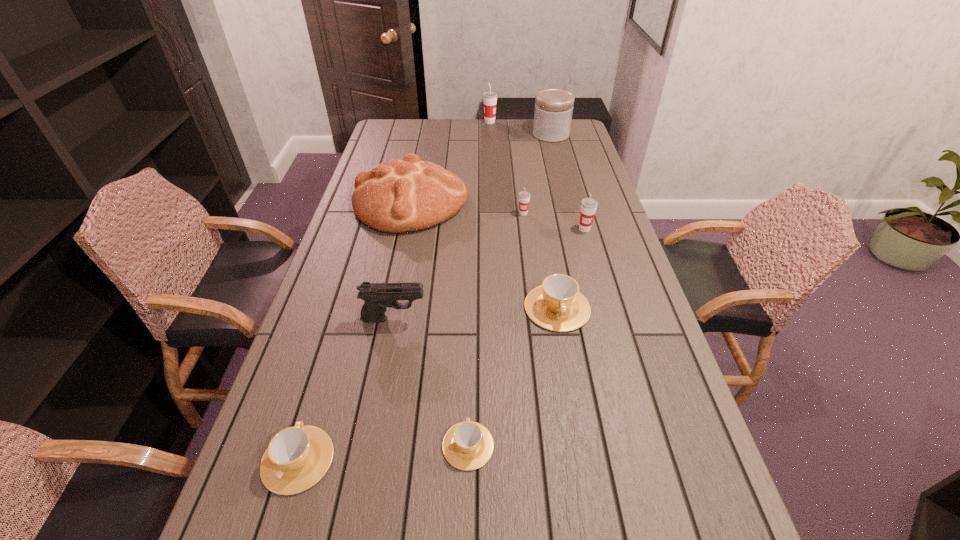
The image size is (960, 540). What are the coordinates of `cup that is at the far edge` in the screenshot? It's located at (490, 97).

You are a GUI agent. You are given a task and a screenshot of the screen. Output one action in this format:
    pyautogui.click(x=<x>, y=<y>)
    Task: Click on the jar situated at the far edge
    The height and width of the screenshot is (540, 960).
    Given the screenshot: What is the action you would take?
    pyautogui.click(x=553, y=111)

In order to click on bread at the left edge in this screenshot , I will do point(397,196).

The width and height of the screenshot is (960, 540). I want to click on pistol that is at the left edge, so click(x=377, y=296).

Where is `cup that is at the left edge`? The width and height of the screenshot is (960, 540). cup that is at the left edge is located at coordinates (297, 457).

Find the location of a particular element. The height and width of the screenshot is (540, 960). jar situated at the right edge is located at coordinates (553, 111).

I want to click on object that is at the far right corner, so click(553, 111).

Find the location of a particular element. Image resolution: width=960 pixels, height=540 pixels. vacant space at the left edge of the desktop is located at coordinates (327, 354).

In the image, there is a desktop. Find the location of `free space at the right edge`. free space at the right edge is located at coordinates (649, 373).

Find the location of `free space between the black pistol and the shortest object`. free space between the black pistol and the shortest object is located at coordinates (431, 382).